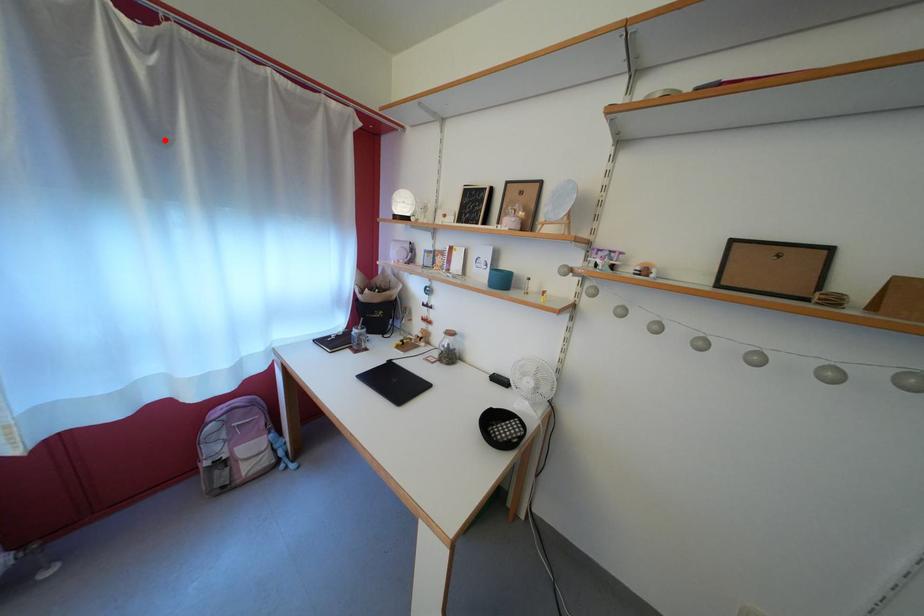
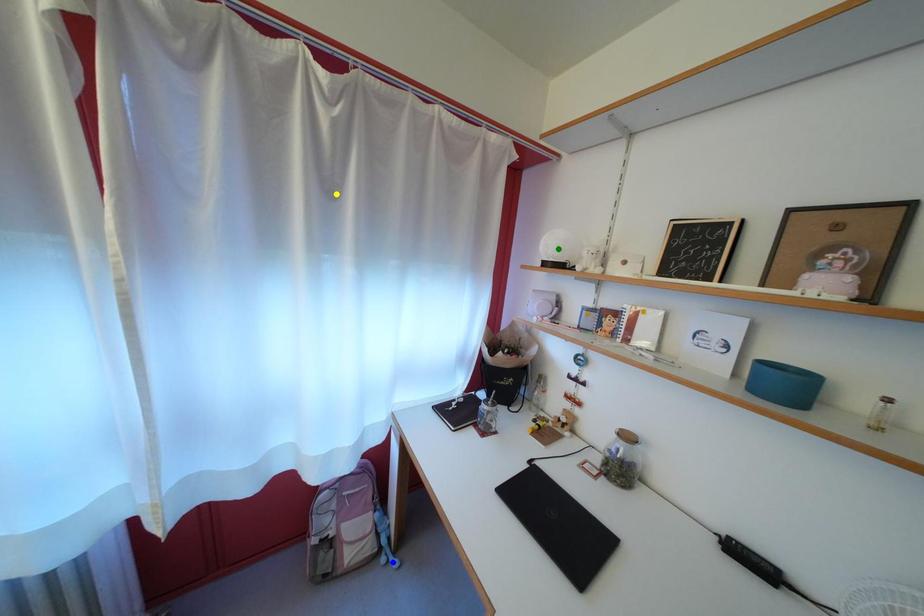
Question: I am providing you with two images of the same scene from different viewpoints. A red point is marked on the first image. You are given multiple points on the second image. Which mark in image 2 goes with the point in image 1?

Choices:
 (A) yellow point
 (B) green point
 (C) blue point

Answer: (A)